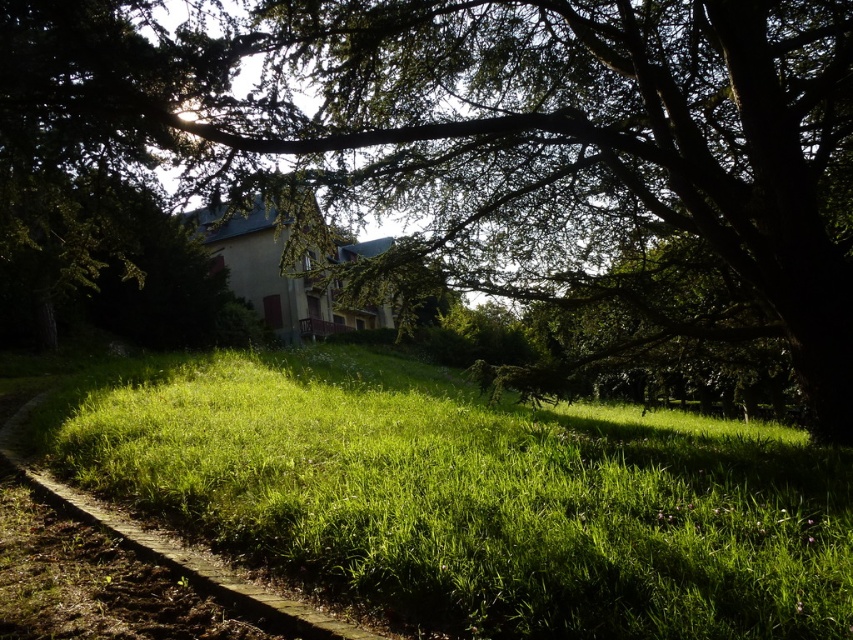
You are standing at the lower left corner of the image and want to walk towards the house. There is a green leafy tree at upper center located at point (508, 141). Will the tree block your path to the house?

The green leafy tree at upper center is located at point (508, 141), which is in the upper center of the image. Since you are starting from the lower left corner and heading toward the house, the tree is positioned along your path. Therefore, the tree will block your view and access to the house.

You are a gardener planning to mow the green grassy at lower left. You have a lawnmower that can handle areas up to the size of the green leafy tree at upper center. Will the lawnmower be sufficient for the task?

The green leafy tree at upper center is bigger than the green grassy at lower left, so the lawnmower, which can handle areas up to the size of the green leafy tree at upper center, will be sufficient for mowing the green grassy at lower left.

You are standing at the point labeled point (86, 45) and want to walk to the point labeled point (598, 481). Given that the path is only 1 meter wide, can you walk directly towards the second point without deviating?

The point (86, 45) is closer to the camera than point (598, 481), so you can walk directly towards the second point as long as the path remains clear and wide enough. Since the path is 1 meter wide, it should be sufficient for your movement.